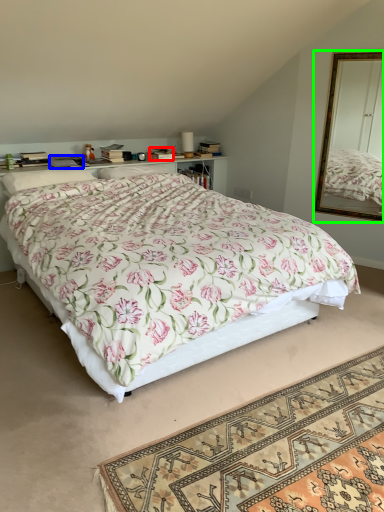
Question: Which is nearer to the box (highlighted by a red box)? book (highlighted by a blue box) or mirror (highlighted by a green box).

Choices:
 (A) book
 (B) mirror

Answer: (A)